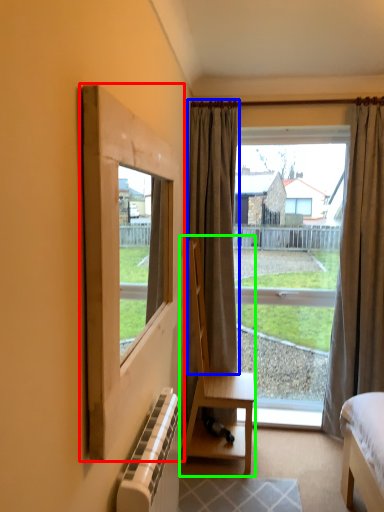
Question: Which object is positioned farthest from window frame (highlighted by a red box)? Select from curtain (highlighted by a blue box) and chair (highlighted by a green box).

Choices:
 (A) curtain
 (B) chair

Answer: (A)